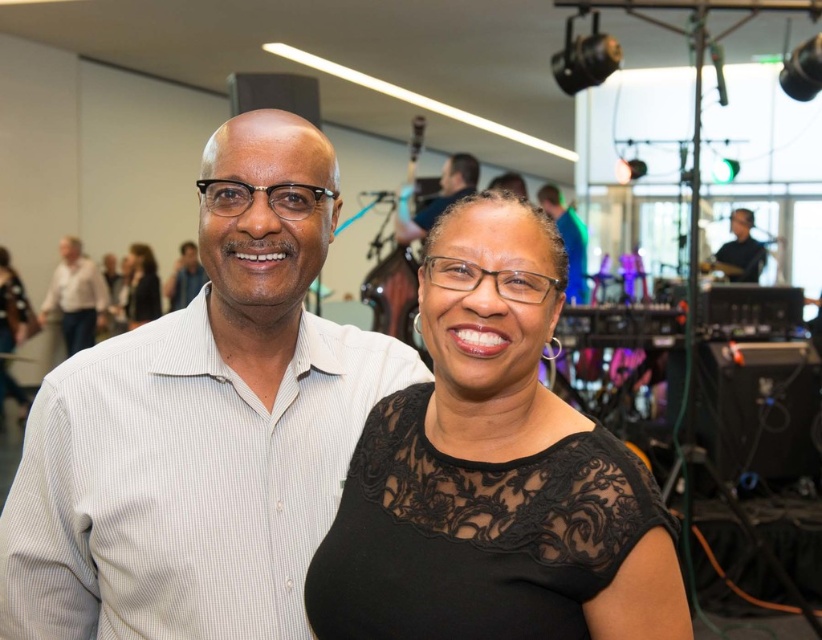
Does black lace dress at center have a larger size compared to matte white shirt at upper left?

No.

The width and height of the screenshot is (822, 640). What do you see at coordinates (493, 474) in the screenshot?
I see `black lace dress at center` at bounding box center [493, 474].

In order to click on black lace dress at center in this screenshot , I will do `click(493, 474)`.

From the picture: Is black lace dress at center to the right of matte black shirt at upper right from the viewer's perspective?

In fact, black lace dress at center is to the left of matte black shirt at upper right.

What do you see at coordinates (493, 474) in the screenshot? I see `black lace dress at center` at bounding box center [493, 474].

You are a GUI agent. You are given a task and a screenshot of the screen. Output one action in this format:
    pyautogui.click(x=<x>, y=<y>)
    Task: Click on the black lace dress at center
    The height and width of the screenshot is (640, 822).
    Given the screenshot: What is the action you would take?
    pyautogui.click(x=493, y=474)

Is white striped shirt at center to the left of matte black shirt at upper right from the viewer's perspective?

Correct, you'll find white striped shirt at center to the left of matte black shirt at upper right.

Does white striped shirt at center appear over matte black shirt at upper right?

Actually, white striped shirt at center is below matte black shirt at upper right.

Does point (54, 400) come closer to viewer compared to point (754, 266)?

Yes, it is.

I want to click on white striped shirt at center, so click(x=202, y=426).